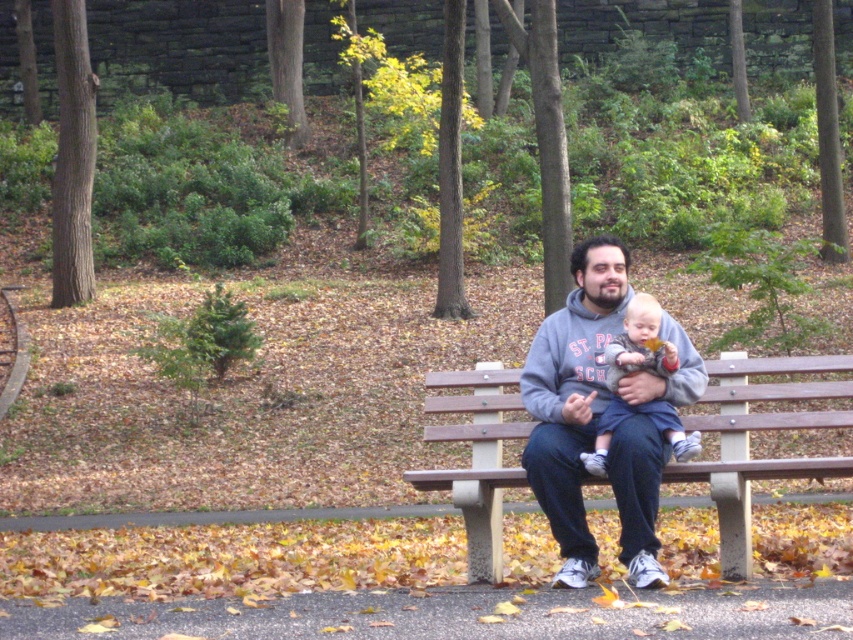
You are a fashion designer observing the scene in the park. You notice the matte gray hoodie at center and the blue denim pants at center. Which clothing item is positioned lower on the person?

The matte gray hoodie at center is located below blue denim pants at center, so the matte gray hoodie at center is positioned lower on the person.

You are standing in the park and see the wooden bench at center and the blue denim pants at center. Which object is positioned more to the right side?

The wooden bench at center is positioned more to the right side than the blue denim pants at center.

You are a park visitor who wants to sit on the wooden bench at center. You are wearing blue denim pants at center. Can your pants fit on the bench without overlapping the edges?

The wooden bench at center is wider than the blue denim pants at center, so yes, the blue denim pants at center can fit on the bench without overlapping the edges.